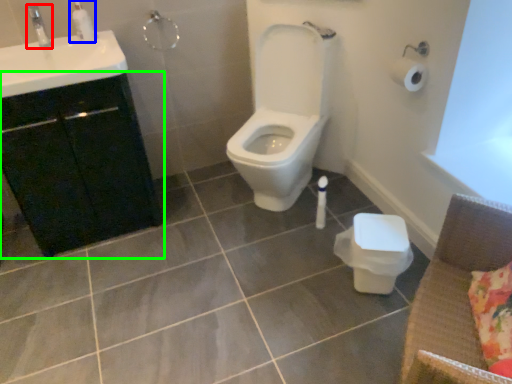
Question: Which object is positioned closest to plumbing fixture (highlighted by a red box)? Select from soap dispenser (highlighted by a blue box) and bathroom cabinet (highlighted by a green box).

Choices:
 (A) soap dispenser
 (B) bathroom cabinet

Answer: (A)